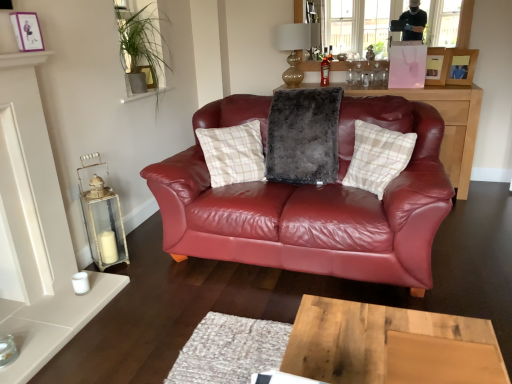
Question: Does plaid fabric pillow at center, the 2th pillow in the left-to-right sequence, have a lesser width compared to matte purple picture frame at upper left, which appears as the 3th picture frame when viewed from the right?

Choices:
 (A) no
 (B) yes

Answer: (A)

Question: Does plaid fabric pillow at center, which ranks as the 1th pillow in right-to-left order, have a smaller size compared to matte purple picture frame at upper left, the first picture frame from the front?

Choices:
 (A) yes
 (B) no

Answer: (B)

Question: Is plaid fabric pillow at center, which ranks as the 1th pillow in right-to-left order, closer to the viewer compared to matte purple picture frame at upper left, which appears as the 3th picture frame when viewed from the right?

Choices:
 (A) no
 (B) yes

Answer: (A)

Question: From the image's perspective, is plaid fabric pillow at center, the 2th pillow in the left-to-right sequence, located above matte purple picture frame at upper left, the first picture frame from the front?

Choices:
 (A) yes
 (B) no

Answer: (B)

Question: From a real-world perspective, is plaid fabric pillow at center, which ranks as the 1th pillow in right-to-left order, located higher than matte purple picture frame at upper left, the first picture frame from the front?

Choices:
 (A) yes
 (B) no

Answer: (B)

Question: Is plaid fabric pillow at center, the 2th pillow in the left-to-right sequence, taller than matte purple picture frame at upper left, the first picture frame from the front?

Choices:
 (A) yes
 (B) no

Answer: (A)

Question: From the image's perspective, is gold glass lampshade at upper center over translucent glass bottle at center?

Choices:
 (A) yes
 (B) no

Answer: (A)

Question: Considering the relative sizes of gold glass lampshade at upper center and translucent glass bottle at center in the image provided, is gold glass lampshade at upper center bigger than translucent glass bottle at center?

Choices:
 (A) no
 (B) yes

Answer: (B)

Question: Is the depth of gold glass lampshade at upper center greater than that of translucent glass bottle at center?

Choices:
 (A) no
 (B) yes

Answer: (A)

Question: From a real-world perspective, is gold glass lampshade at upper center under translucent glass bottle at center?

Choices:
 (A) yes
 (B) no

Answer: (B)

Question: From a real-world perspective, is gold glass lampshade at upper center over translucent glass bottle at center?

Choices:
 (A) yes
 (B) no

Answer: (A)

Question: From the image's perspective, does gold glass lampshade at upper center appear lower than translucent glass bottle at center?

Choices:
 (A) yes
 (B) no

Answer: (B)

Question: Does translucent glass bottle at center have a greater width compared to fuzzy gray pillow at center, which appears as the 1th pillow when viewed from the left?

Choices:
 (A) yes
 (B) no

Answer: (B)